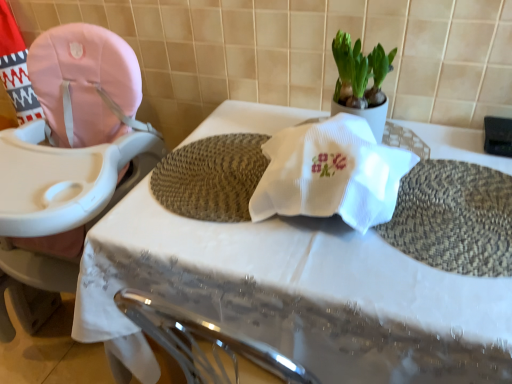
Question: Is white woven placemat at center smaller than pink fabric baby carriage at left?

Choices:
 (A) no
 (B) yes

Answer: (A)

Question: Is pink fabric baby carriage at left at the back of white woven placemat at center?

Choices:
 (A) no
 (B) yes

Answer: (A)

Question: From the image's perspective, would you say white woven placemat at center is positioned over pink fabric baby carriage at left?

Choices:
 (A) yes
 (B) no

Answer: (B)

Question: Is pink fabric baby carriage at left inside white woven placemat at center?

Choices:
 (A) no
 (B) yes

Answer: (A)

Question: From a real-world perspective, is white woven placemat at center over pink fabric baby carriage at left?

Choices:
 (A) no
 (B) yes

Answer: (A)

Question: Does white woven placemat at center have a larger size compared to pink fabric baby carriage at left?

Choices:
 (A) no
 (B) yes

Answer: (B)

Question: Is pink fabric baby carriage at left thinner than white woven placemat at center?

Choices:
 (A) yes
 (B) no

Answer: (B)

Question: Does pink fabric baby carriage at left have a lesser height compared to white woven placemat at center?

Choices:
 (A) no
 (B) yes

Answer: (A)

Question: Is pink fabric baby carriage at left taller than white woven placemat at center?

Choices:
 (A) yes
 (B) no

Answer: (A)

Question: From a real-world perspective, is pink fabric baby carriage at left on top of white woven placemat at center?

Choices:
 (A) no
 (B) yes

Answer: (B)

Question: Does pink fabric baby carriage at left have a larger size compared to white woven placemat at center?

Choices:
 (A) yes
 (B) no

Answer: (B)

Question: Is pink fabric baby carriage at left to the right of white woven placemat at center from the viewer's perspective?

Choices:
 (A) no
 (B) yes

Answer: (A)

Question: Would you say white woven placemat at center is outside green leafy plant at upper center?

Choices:
 (A) no
 (B) yes

Answer: (B)